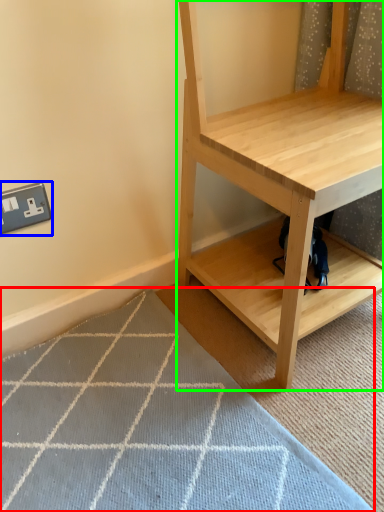
Question: Which object is positioned closest to doormat (highlighted by a red box)? Select from electric outlet (highlighted by a blue box) and shelf (highlighted by a green box).

Choices:
 (A) electric outlet
 (B) shelf

Answer: (B)